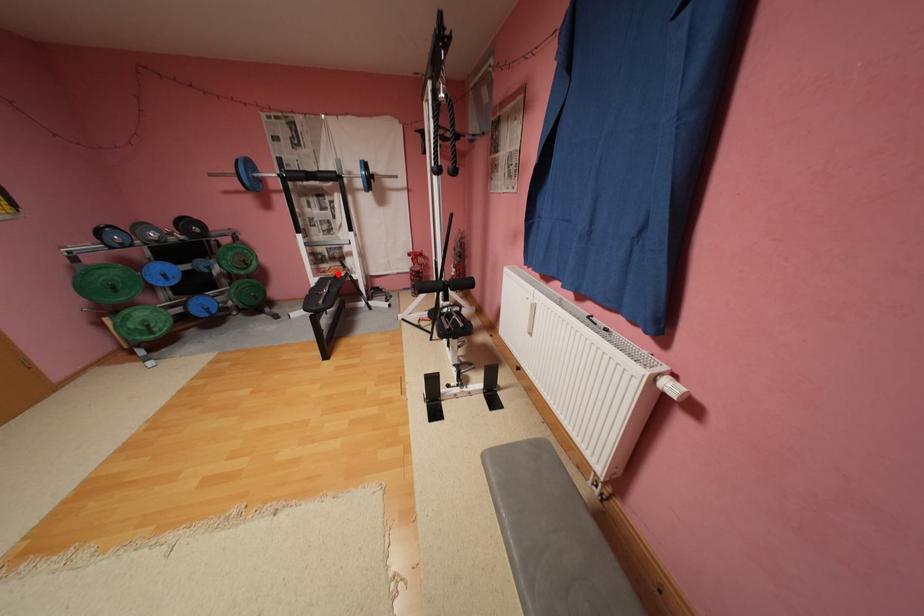
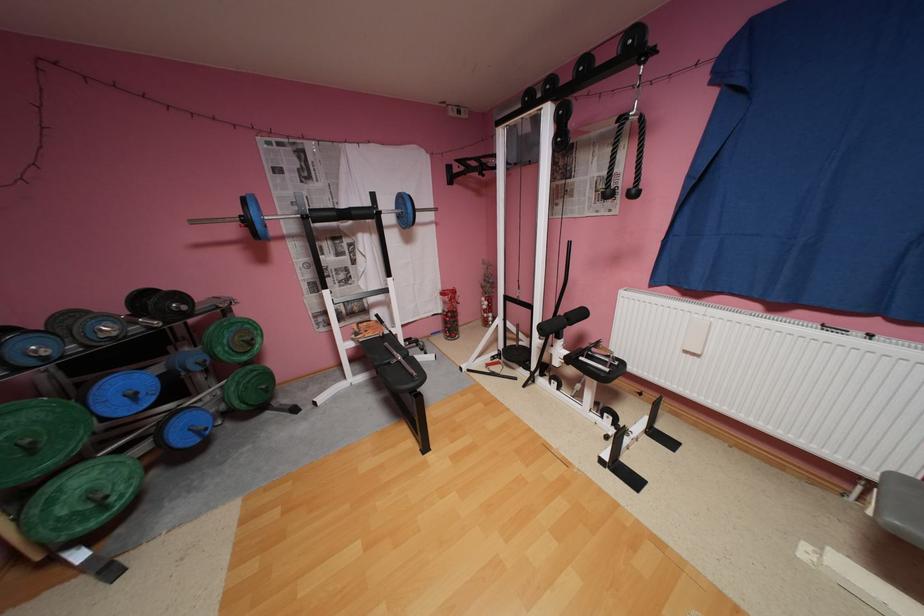
Question: I am providing you with two images of the same scene from different viewpoints. Given a red point in image1, look at the same physical point in image2. Is it:

Choices:
 (A) Closer to the viewpoint
 (B) Farther from the viewpoint

Answer: (B)